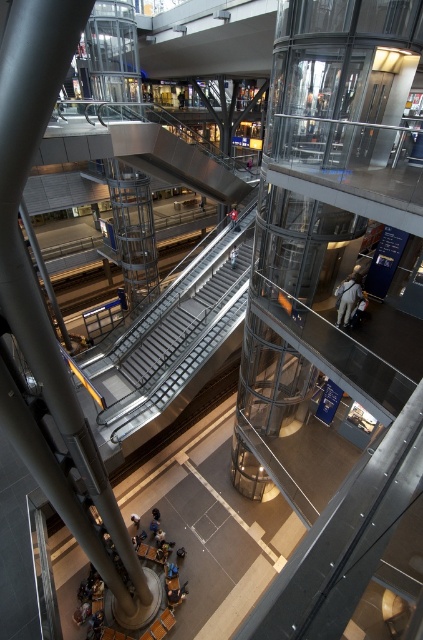
Question: Which of the following is the farthest from the observer?

Choices:
 (A) metallic silver escalator at center
 (B) light brown leather jacket at center
 (C) white fabric person at center

Answer: (C)

Question: Estimate the real-world distances between objects in this image. Which object is farther from the white fabric person at center?

Choices:
 (A) metallic silver escalator at center
 (B) red fabric jacket at center

Answer: (A)

Question: From the image, what is the correct spatial relationship of light brown leather jacket at center in relation to red fabric jacket at center?

Choices:
 (A) left
 (B) right

Answer: (B)

Question: Which point is closer to the camera taking this photo?

Choices:
 (A) (357, 301)
 (B) (230, 259)
 (C) (231, 208)
 (D) (230, 246)

Answer: (A)

Question: Can you confirm if light brown leather jacket at center is positioned to the left of red fabric jacket at center?

Choices:
 (A) no
 (B) yes

Answer: (A)

Question: Can you confirm if light brown leather jacket at center is thinner than white fabric person at center?

Choices:
 (A) no
 (B) yes

Answer: (A)